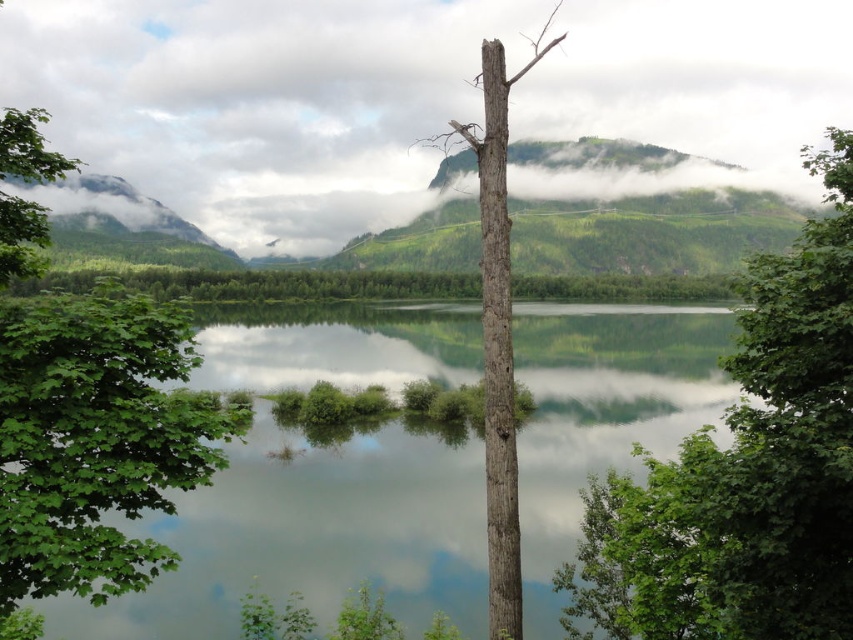
Question: Among these objects, which one is nearest to the camera?

Choices:
 (A) green forested mountain at upper left
 (B) grayish-brown bark tree at center
 (C) green matte water at center
 (D) white fluffy cloud at center

Answer: (B)

Question: Is green matte tree at upper right positioned before green forested mountain at upper left?

Choices:
 (A) no
 (B) yes

Answer: (B)

Question: Is white fluffy cloud at center smaller than green matte tree at upper right?

Choices:
 (A) yes
 (B) no

Answer: (B)

Question: Which object appears closest to the camera in this image?

Choices:
 (A) white fluffy cloud at center
 (B) green matte tree at upper right
 (C) green matte water at center
 (D) green leafy tree at left

Answer: (D)

Question: Is green matte water at center wider than green forested mountain at upper left?

Choices:
 (A) no
 (B) yes

Answer: (B)

Question: Which point is closer to the camera taking this photo?

Choices:
 (A) (839, 548)
 (B) (138, 358)

Answer: (B)